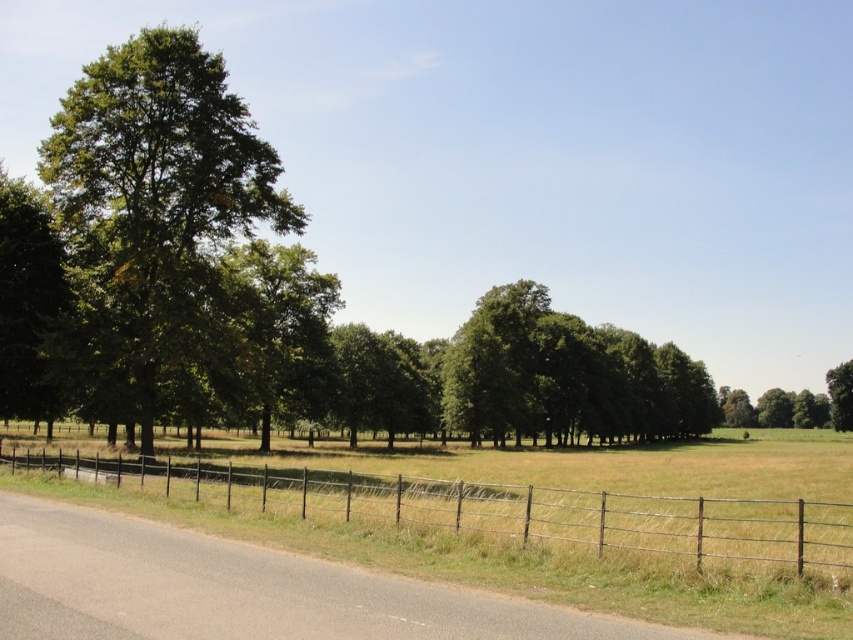
You are a painter setting up an easel to capture the rural landscape. You want to ensure your painting accurately represents the scene. Which object, the metallic wire fence at lower center or the green leafy tree at right, should you depict as narrower in your artwork?

The metallic wire fence at lower center is thinner than the green leafy tree at right, so you should depict the metallic wire fence at lower center as narrower in your artwork.

You are a painter wanting to capture the scene. You notice the green leafy tree at left and the metallic wire fence at lower center. Which object is closer to the left edge of your canvas?

The green leafy tree at left is positioned on the left side of metallic wire fence at lower center, so it is closer to the left edge of your canvas.

In the scene shown: You are a hiker standing on the paved road and want to take a photo of the green leafy tree at left. However, there is a metallic wire fence at lower center in your way. Can you adjust your position to capture the tree without the fence obstructing the view?

The metallic wire fence at lower center is behind the green leafy tree at left, so you can move to the side of the tree to take the photo without the fence blocking the view.